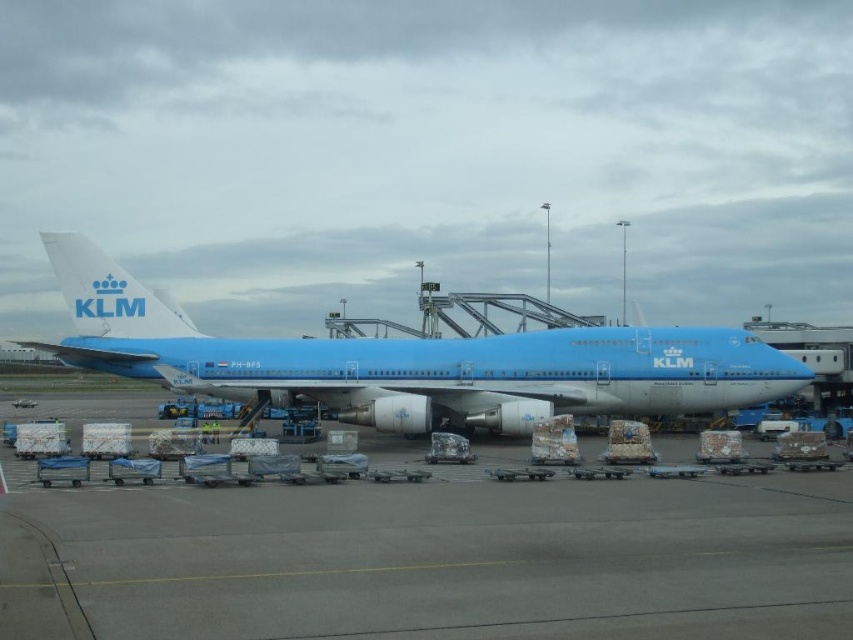
Question: Which point is closer to the camera taking this photo?

Choices:
 (A) (447, 396)
 (B) (248, 557)

Answer: (B)

Question: Can you confirm if blue matte tarmac at center is thinner than blue matte airplane at center?

Choices:
 (A) yes
 (B) no

Answer: (A)

Question: Can you confirm if blue matte tarmac at center is wider than blue matte airplane at center?

Choices:
 (A) yes
 (B) no

Answer: (B)

Question: Can you confirm if blue matte tarmac at center is thinner than blue matte airplane at center?

Choices:
 (A) no
 (B) yes

Answer: (B)